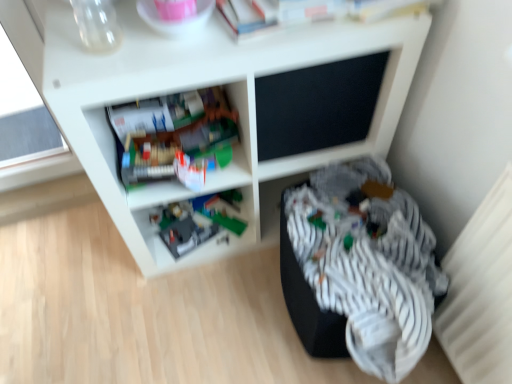
Where is `free space above striped fabric at lower right (from a real-world perspective)`? The width and height of the screenshot is (512, 384). free space above striped fabric at lower right (from a real-world perspective) is located at coordinates (337, 230).